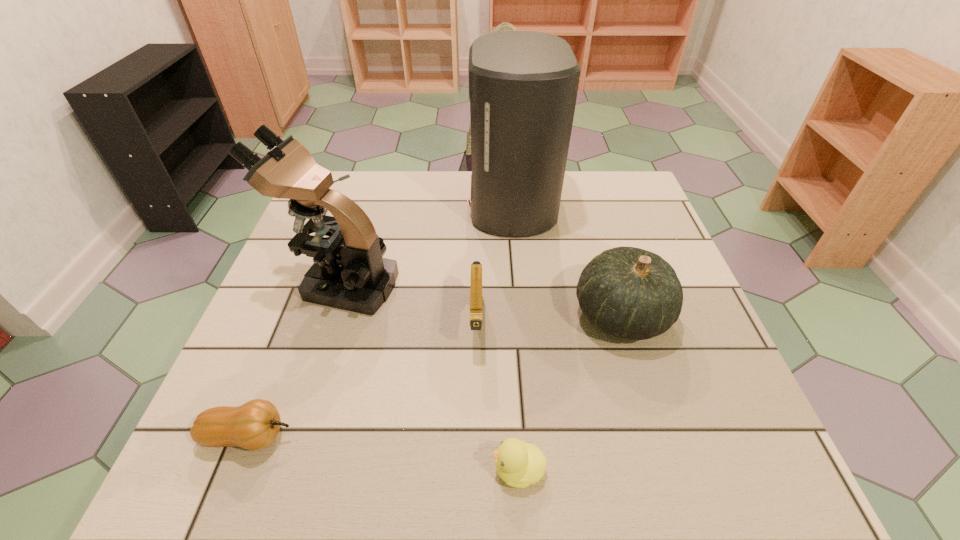
I want to click on duckling located in the near edge section of the desktop, so click(519, 464).

In order to click on microscope that is at the left edge in this screenshot , I will do `click(349, 273)`.

Locate an element on the screen. gourd at the left edge is located at coordinates (254, 425).

The image size is (960, 540). Find the location of `object that is at the right edge`. object that is at the right edge is located at coordinates (627, 292).

Where is `object present at the near left corner`? This screenshot has width=960, height=540. object present at the near left corner is located at coordinates (254, 425).

In the image, there is a desktop. Where is `blank space at the far edge`? The image size is (960, 540). blank space at the far edge is located at coordinates (456, 171).

This screenshot has height=540, width=960. I want to click on free point at the near edge, so click(x=617, y=485).

You are a GUI agent. You are given a task and a screenshot of the screen. Output one action in this format:
    pyautogui.click(x=<x>, y=<y>)
    Task: Click on the vacant region at the left edge
    This screenshot has height=540, width=960.
    Given the screenshot: What is the action you would take?
    pyautogui.click(x=286, y=357)

The height and width of the screenshot is (540, 960). I want to click on vacant space at the right edge of the desktop, so click(693, 432).

I want to click on vacant area at the far left corner of the desktop, so click(369, 190).